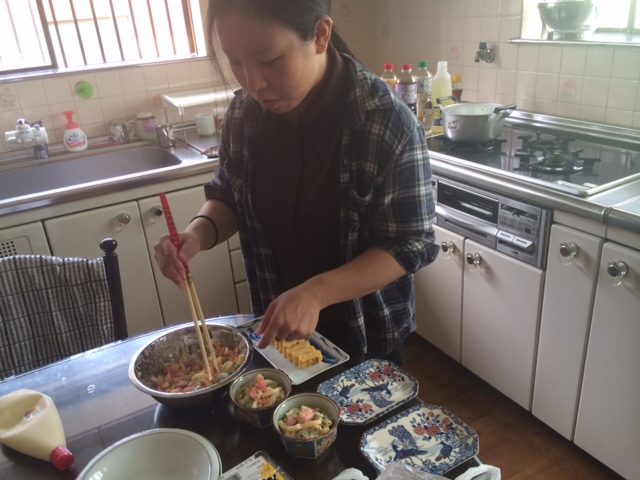
This screenshot has width=640, height=480. Identify the location of metal bowl. (138, 381).